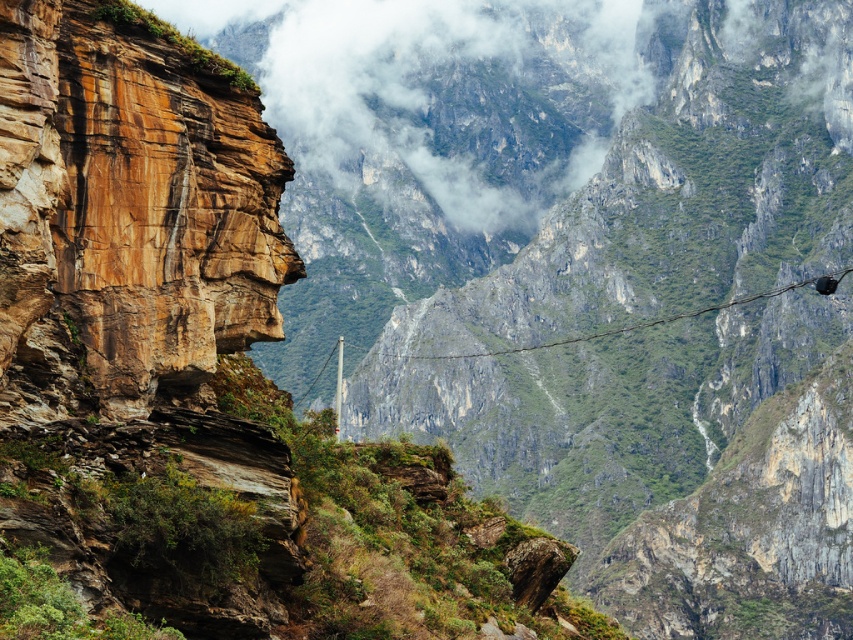
Question: Considering the real-world distances, which object is closest to the rustic stone face at upper left?

Choices:
 (A) white fluffy cloud at upper center
 (B) rustic wire at center

Answer: (B)

Question: Which point is farther to the camera?

Choices:
 (A) white fluffy cloud at upper center
 (B) rustic wire at center
 (C) rustic stone face at upper left

Answer: (B)

Question: Where is white fluffy cloud at upper center located in relation to rustic wire at center in the image?

Choices:
 (A) above
 (B) below

Answer: (A)

Question: Can you confirm if rustic stone face at upper left is wider than rustic wire at center?

Choices:
 (A) yes
 (B) no

Answer: (B)

Question: Which point appears farthest from the camera in this image?

Choices:
 (A) (86, 145)
 (B) (718, 308)
 (C) (514, 122)

Answer: (C)

Question: Can you confirm if white fluffy cloud at upper center is positioned to the left of rustic wire at center?

Choices:
 (A) yes
 (B) no

Answer: (A)